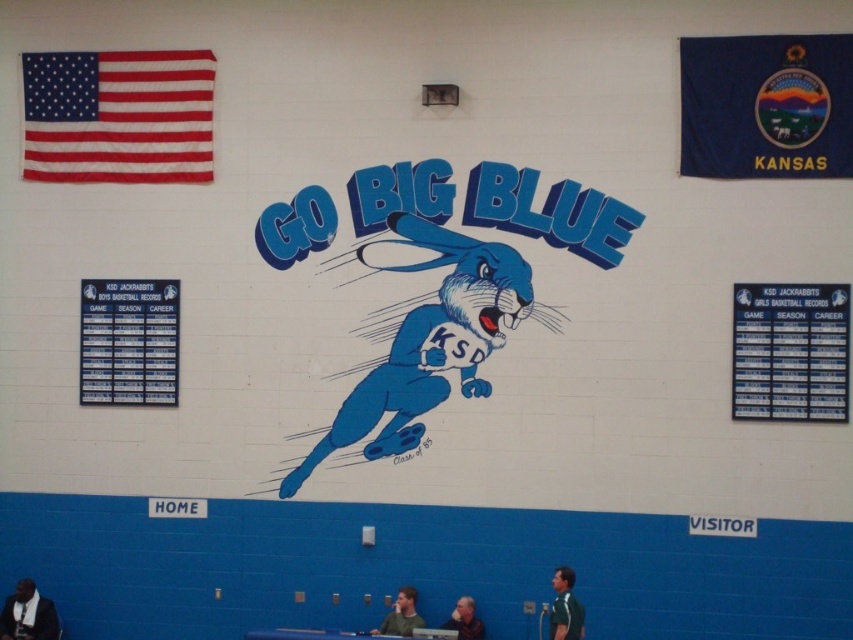
Question: Among these objects, which one is nearest to the camera?

Choices:
 (A) green fabric shirt at lower right
 (B) blue fabric kansas flag at upper right
 (C) dark brown leather jacket at lower center
 (D) textured fabric flag at upper left

Answer: (A)

Question: Is blue fabric kansas flag at upper right wider than dark brown leather jacket at lower center?

Choices:
 (A) no
 (B) yes

Answer: (B)

Question: Considering the real-world distances, which object is closest to the dark blue shirt at lower left?

Choices:
 (A) green fabric shirt at lower right
 (B) blue fabric kansas flag at upper right
 (C) blue plastic scoreboard at upper right

Answer: (A)

Question: Does textured fabric flag at upper left have a greater width compared to green fabric shirt at lower right?

Choices:
 (A) no
 (B) yes

Answer: (B)

Question: Observing the image, what is the correct spatial positioning of blue plastic scoreboard at upper right in reference to dark brown leather jacket at lower center?

Choices:
 (A) left
 (B) right

Answer: (B)

Question: Which of the following is the farthest from the observer?

Choices:
 (A) (689, 131)
 (B) (15, 593)

Answer: (B)